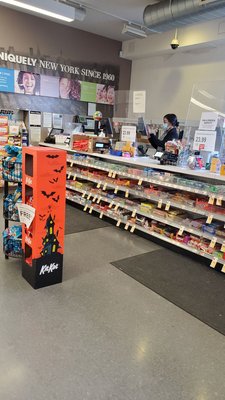
Find the location of a particular element. mat is located at coordinates (176, 267).